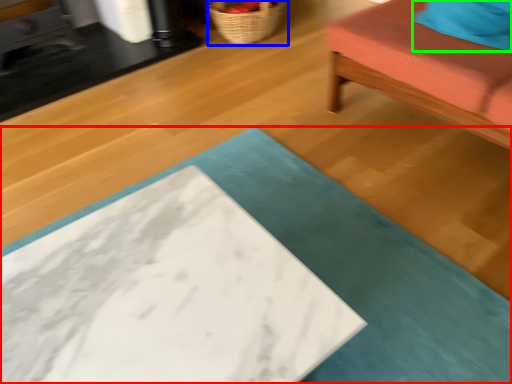
Question: Which is nearer to the table (highlighted by a red box)? basket (highlighted by a blue box) or pillow (highlighted by a green box).

Choices:
 (A) basket
 (B) pillow

Answer: (B)